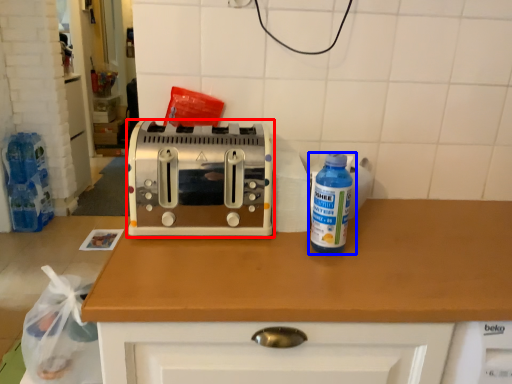
Question: Among these objects, which one is farthest to the camera, toaster (highlighted by a red box) or bottle (highlighted by a blue box)?

Choices:
 (A) toaster
 (B) bottle

Answer: (A)